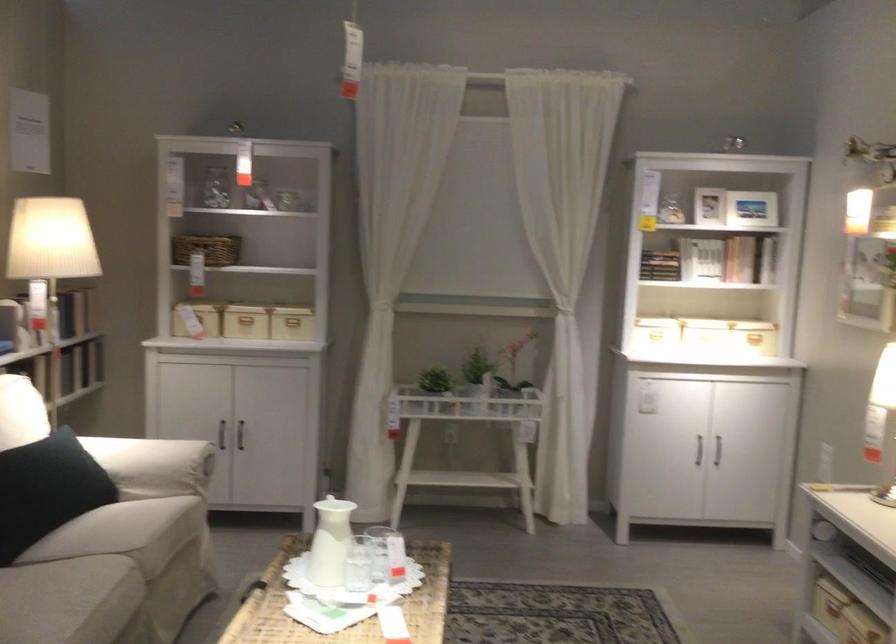
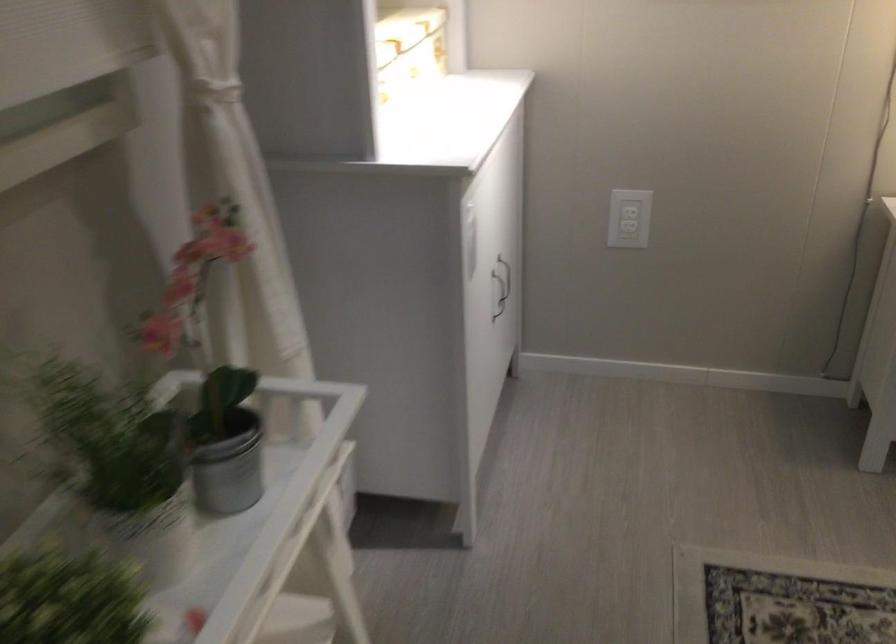
Question: I am providing you with two images of the same scene from different viewpoints. Which of the following objects are not visible in image2?

Choices:
 (A) patterned storage box
 (B) metal plant pot
 (C) floral throw pillow
 (D) dark cabinet handle

Answer: (D)